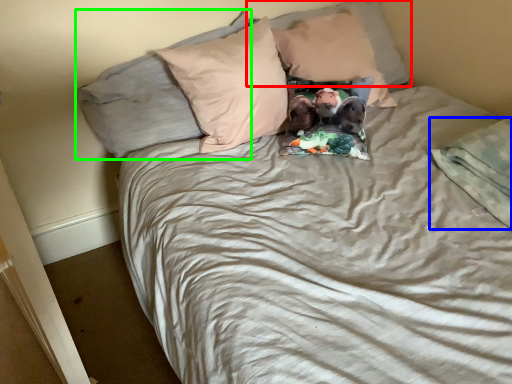
Question: Based on their relative distances, which object is nearer to pillow (highlighted by a red box)? Choose from blanket (highlighted by a blue box) and pillow (highlighted by a green box).

Choices:
 (A) blanket
 (B) pillow

Answer: (B)